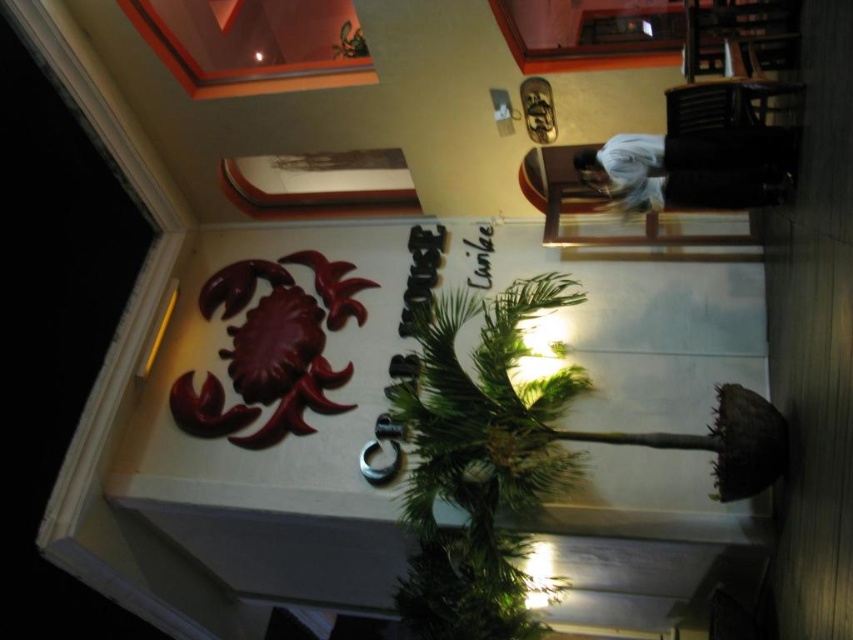
Question: Is green leafy palm tree at center in front of white cotton shirt at upper right?

Choices:
 (A) no
 (B) yes

Answer: (A)

Question: Observing the image, what is the correct spatial positioning of green leafy palm tree at center in reference to white cotton shirt at upper right?

Choices:
 (A) right
 (B) left

Answer: (B)

Question: Which point is closer to the camera taking this photo?

Choices:
 (A) (558, 387)
 (B) (741, 148)

Answer: (B)

Question: Which point is closer to the camera taking this photo?

Choices:
 (A) (669, 164)
 (B) (569, 458)

Answer: (A)

Question: Can you confirm if green leafy palm tree at center is positioned to the left of white cotton shirt at upper right?

Choices:
 (A) yes
 (B) no

Answer: (A)